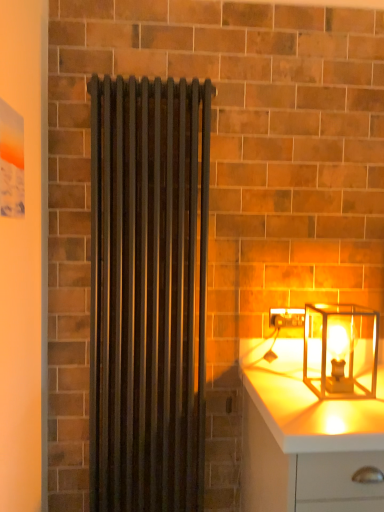
Question: Is white glossy chest of drawers at lower right surrounded by translucent glass lantern at right?

Choices:
 (A) yes
 (B) no

Answer: (B)

Question: Is translucent glass lantern at right to the left of white glossy chest of drawers at lower right from the viewer's perspective?

Choices:
 (A) yes
 (B) no

Answer: (A)

Question: Are translucent glass lantern at right and white glossy chest of drawers at lower right far apart?

Choices:
 (A) yes
 (B) no

Answer: (B)

Question: Is translucent glass lantern at right located outside white glossy chest of drawers at lower right?

Choices:
 (A) no
 (B) yes

Answer: (B)

Question: Is the depth of translucent glass lantern at right greater than that of white glossy chest of drawers at lower right?

Choices:
 (A) no
 (B) yes

Answer: (B)

Question: Is translucent glass lantern at right smaller than white glossy chest of drawers at lower right?

Choices:
 (A) no
 (B) yes

Answer: (B)

Question: Considering the relative positions of translucent glass lantern at right and matte black radiator at center in the image provided, is translucent glass lantern at right to the right of matte black radiator at center from the viewer's perspective?

Choices:
 (A) no
 (B) yes

Answer: (B)

Question: Considering the relative sizes of translucent glass lantern at right and matte black radiator at center in the image provided, is translucent glass lantern at right shorter than matte black radiator at center?

Choices:
 (A) no
 (B) yes

Answer: (B)

Question: Considering the relative positions of translucent glass lantern at right and matte black radiator at center in the image provided, is translucent glass lantern at right behind matte black radiator at center?

Choices:
 (A) no
 (B) yes

Answer: (A)

Question: Considering the relative positions of translucent glass lantern at right and matte black radiator at center in the image provided, is translucent glass lantern at right to the left of matte black radiator at center from the viewer's perspective?

Choices:
 (A) no
 (B) yes

Answer: (A)

Question: Considering the relative sizes of translucent glass lantern at right and matte black radiator at center in the image provided, is translucent glass lantern at right taller than matte black radiator at center?

Choices:
 (A) yes
 (B) no

Answer: (B)

Question: Can you confirm if translucent glass lantern at right is smaller than matte black radiator at center?

Choices:
 (A) yes
 (B) no

Answer: (A)

Question: Is white glossy chest of drawers at lower right wider than translucent glass lantern at right?

Choices:
 (A) yes
 (B) no

Answer: (A)